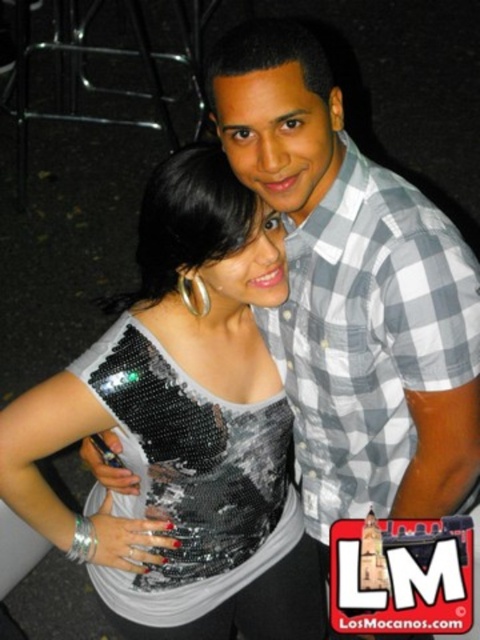
You are a photographer trying to adjust the lighting for a photo shoot. You notice the sequined fabric top at center and the gray checkered shirt at upper right. Which clothing item requires more vertical space in the frame to capture its full height?

The sequined fabric top at center requires more vertical space in the frame because it has a greater height compared to the gray checkered shirt at upper right.

You are standing in front of the two people in the image. The gray checkered shirt at upper right and the sequined fabric dress at center are both visible. Which one is positioned more to the right?

The gray checkered shirt at upper right is positioned more to the right than the sequined fabric dress at center.

You are a photographer trying to adjust the lighting for a photo shoot. You notice two items in the scene with sequined fabric. The sequined fabric top at center and the sequined fabric dress at center. Which one should you focus your spotlight on if you want to highlight the item that is positioned to the left?

The sequined fabric top at center is to the left of the sequined fabric dress at center, so you should focus your spotlight on the sequined fabric top at center to highlight the item on the left.